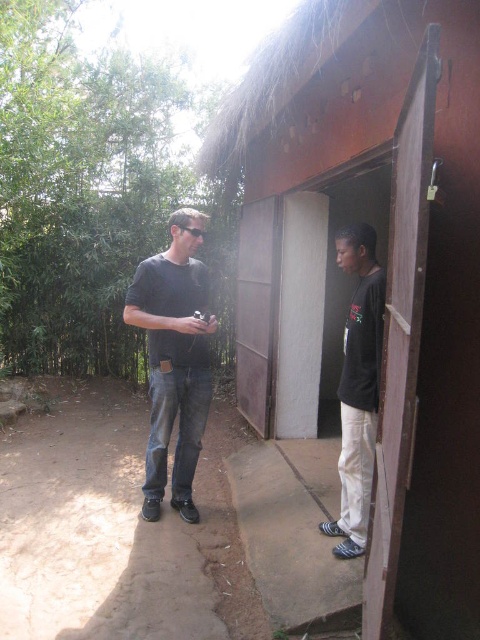
You are a photographer trying to capture a candid shot of both the denim jeans at center and the black matte shirt at center. Since you want to ensure both subjects are fully visible in the frame, which subject should you position closer to the camera?

The black matte shirt at center is behind denim jeans at center, so you should position the denim jeans at center closer to the camera to ensure both are visible without one blocking the other.

Consider the image. You are standing at the point with coordinates point (156, 397) and want to walk to the wooden door frame of the hut. There is a point at point (370, 564) in your path. Can you safely walk straight to the door without passing through the other point?

Point (370, 564) is in front of point (156, 397), so walking straight towards the wooden door frame would require passing through the point (370, 564). Therefore, you cannot walk straight to the door without passing through the other point.

You are a delivery robot with a width of 1 meter. You need to pass between the denim jeans at center and the black matte shirt at center to reach the hut. Can you fit through the space between them?

The distance between denim jeans at center and black matte shirt at center is 1.14 meters. Since the robot is 1 meter wide, it can fit through the space as there is enough width available.